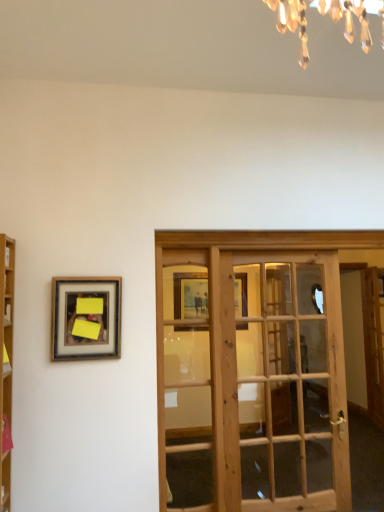
Question: Is the surface of wooden french door at center in direct contact with wooden framed picture at left?

Choices:
 (A) yes
 (B) no

Answer: (B)

Question: From a real-world perspective, does wooden french door at center sit lower than wooden framed picture at left?

Choices:
 (A) no
 (B) yes

Answer: (B)

Question: From a real-world perspective, is wooden french door at center located higher than wooden framed picture at left?

Choices:
 (A) yes
 (B) no

Answer: (B)

Question: From the image's perspective, is wooden french door at center located above wooden framed picture at left?

Choices:
 (A) no
 (B) yes

Answer: (A)

Question: From the image's perspective, is wooden french door at center below wooden framed picture at left?

Choices:
 (A) yes
 (B) no

Answer: (A)

Question: Can you confirm if wooden french door at center is positioned to the right of wooden framed picture at left?

Choices:
 (A) yes
 (B) no

Answer: (A)

Question: Would you consider wooden framed picture at left to be distant from wooden french door at center?

Choices:
 (A) yes
 (B) no

Answer: (B)

Question: Does wooden framed picture at left appear on the left side of wooden french door at center?

Choices:
 (A) no
 (B) yes

Answer: (B)

Question: Can we say wooden framed picture at left lies outside wooden french door at center?

Choices:
 (A) no
 (B) yes

Answer: (B)

Question: Is wooden framed picture at left to the right of wooden french door at center from the viewer's perspective?

Choices:
 (A) yes
 (B) no

Answer: (B)

Question: Can you confirm if wooden framed picture at left is smaller than wooden french door at center?

Choices:
 (A) yes
 (B) no

Answer: (A)

Question: Can you confirm if wooden framed picture at left is taller than wooden french door at center?

Choices:
 (A) no
 (B) yes

Answer: (A)

Question: Would you say wooden bookshelf at left is part of wooden french door at center's contents?

Choices:
 (A) no
 (B) yes

Answer: (A)